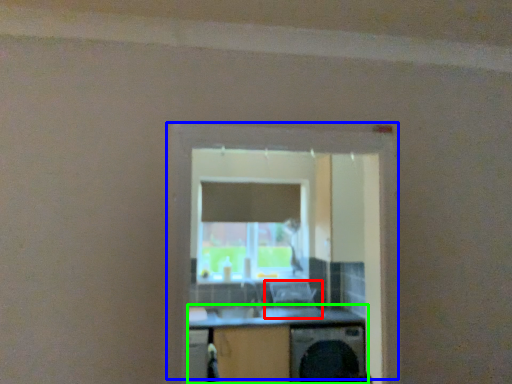
Question: Which object is positioned closest to computer chair (highlighted by a red box)? Select from window (highlighted by a blue box) and computer desk (highlighted by a green box).

Choices:
 (A) window
 (B) computer desk

Answer: (B)